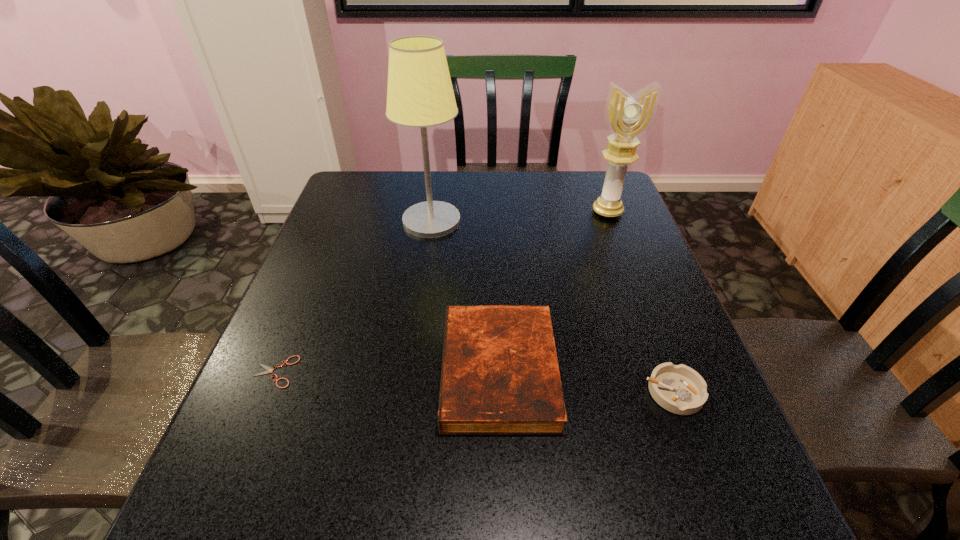
This screenshot has width=960, height=540. I want to click on the tallest object, so click(419, 94).

The height and width of the screenshot is (540, 960). Find the location of `the fourth shortest object`. the fourth shortest object is located at coordinates (628, 116).

You are a GUI agent. You are given a task and a screenshot of the screen. Output one action in this format:
    pyautogui.click(x=<x>, y=<y>)
    Task: Click on the Bible
    This screenshot has height=540, width=960.
    Given the screenshot: What is the action you would take?
    pyautogui.click(x=500, y=376)

Where is `the second shortest object`? The width and height of the screenshot is (960, 540). the second shortest object is located at coordinates (679, 389).

Identify the location of the shortest object. The image size is (960, 540). (269, 370).

This screenshot has width=960, height=540. What are the coordinates of `the leftmost object` in the screenshot? It's located at (269, 370).

This screenshot has height=540, width=960. Identify the location of free space located 0.390m on the front of the tallest object. (414, 349).

In order to click on vacant space located on the front-facing side of the award in this screenshot , I will do `click(623, 253)`.

Locate an element on the screen. This screenshot has height=540, width=960. free location located on the spine side of the third shortest object is located at coordinates (307, 371).

Where is `vacant space located 0.160m on the spine side of the third shortest object`? This screenshot has width=960, height=540. vacant space located 0.160m on the spine side of the third shortest object is located at coordinates (366, 371).